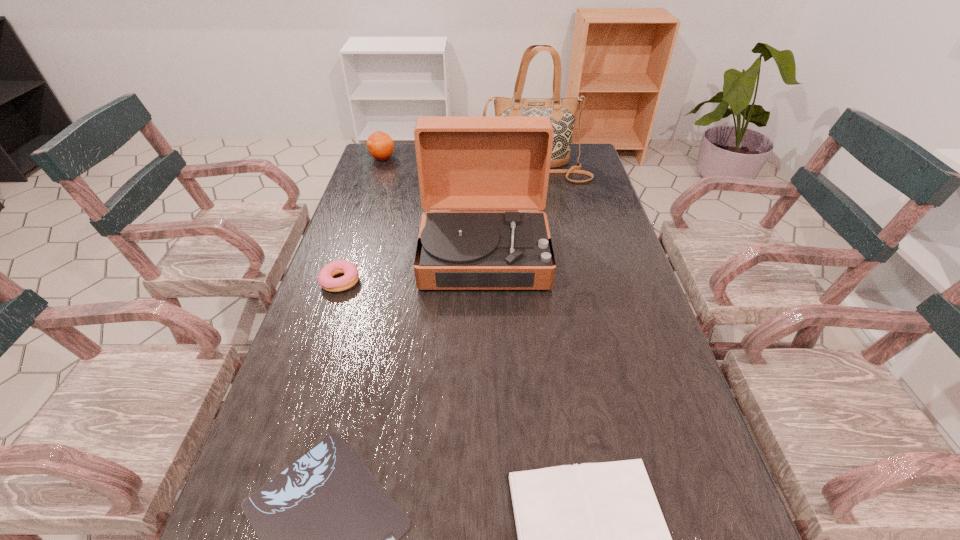
Identify the location of orange that is at the left edge. Image resolution: width=960 pixels, height=540 pixels. (380, 145).

Locate an element on the screen. doughnut that is positioned at the left edge is located at coordinates (325, 278).

I want to click on object that is positioned at the right edge, so click(x=562, y=111).

Locate an element on the screen. This screenshot has height=540, width=960. object located in the far left corner section of the desktop is located at coordinates (380, 145).

Identify the location of object that is at the far right corner. The image size is (960, 540). (562, 111).

The height and width of the screenshot is (540, 960). Find the location of `vacant space at the left edge of the desktop`. vacant space at the left edge of the desktop is located at coordinates (313, 417).

Where is `vacant space at the right edge`? This screenshot has height=540, width=960. vacant space at the right edge is located at coordinates (668, 362).

This screenshot has height=540, width=960. Find the location of `vacant space at the far left corner of the desktop`. vacant space at the far left corner of the desktop is located at coordinates (405, 146).

Choose which object is the third nearest neighbor to the phonograph record. Please provide its 2D coordinates. Your answer should be formatted as a tuple, i.e. [(x, y)], where the tuple contains the x and y coordinates of a point satisfying the conditions above.

[(380, 145)]

Identify which object is the fifth nearest to the second shortest object. Please provide its 2D coordinates. Your answer should be formatted as a tuple, i.e. [(x, y)], where the tuple contains the x and y coordinates of a point satisfying the conditions above.

[(380, 145)]